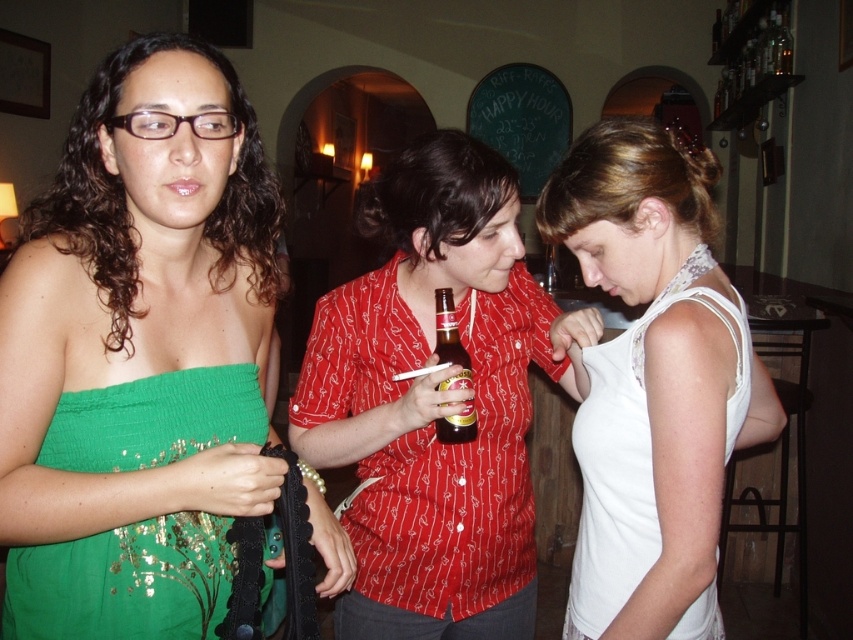
You are standing in the bar and want to take a photo of both point (373, 339) and point (434, 420). Which point is closer to your camera?

Point (373, 339) is further to the camera than point (434, 420), so the point closer to your camera is point (434, 420).

You are a photographer adjusting your camera settings to focus on two specific points in the image. The first point is at coordinates point (367, 198) and the second point is at point (51, 428). Which point should you focus on first if you want to ensure both points are in sharp focus?

You should focus on point (367, 198) first because it is closer to the camera than point (51, 428). By focusing on the closer point, the further point may still be within the depth of field, ensuring both are in focus.

You are a photographer at this event and need to decide which clothing item to focus on for a closeup shot. Since the matte red shirt at center and the green sequined dress at center are both in the frame, which one would you choose if you want to capture more details without cropping?

The matte red shirt at center is bigger than the green sequined dress at center, so focusing on the matte red shirt at center would allow you to capture more details without cropping.